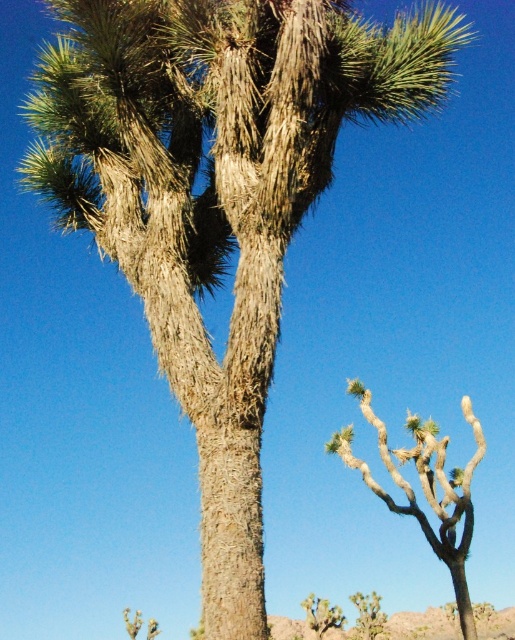
Question: Where is green spiky plant at lower center located in relation to green spiky cactus at lower right in the image?

Choices:
 (A) below
 (B) above

Answer: (A)

Question: Which point is farther from the camera taking this photo?

Choices:
 (A) click(472, 625)
 (B) click(358, 634)
 (C) click(325, 605)

Answer: (B)

Question: Among these points, which one is nearest to the camera?

Choices:
 (A) (313, 636)
 (B) (353, 458)
 (C) (379, 600)

Answer: (B)

Question: Can you confirm if green spiky plant at lower center is bigger than green spiky cactus at lower right?

Choices:
 (A) no
 (B) yes

Answer: (B)

Question: Is green spiky plant at lower center behind green spiky cactus at lower right?

Choices:
 (A) yes
 (B) no

Answer: (B)

Question: Based on their relative distances, which object is farther from the green spiky cactus at lower right?

Choices:
 (A) green spiky plant at lower center
 (B) brown textured joshua tree at lower right

Answer: (B)